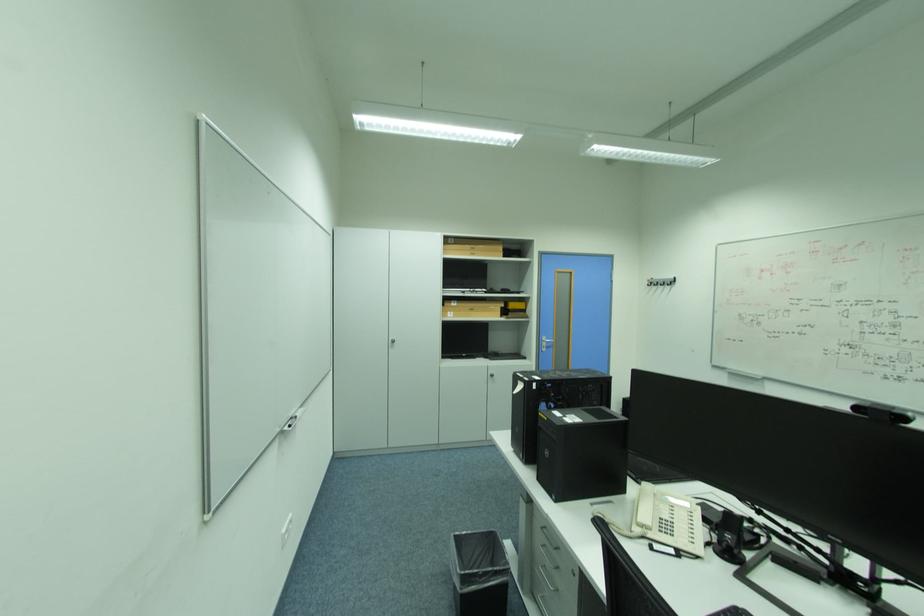
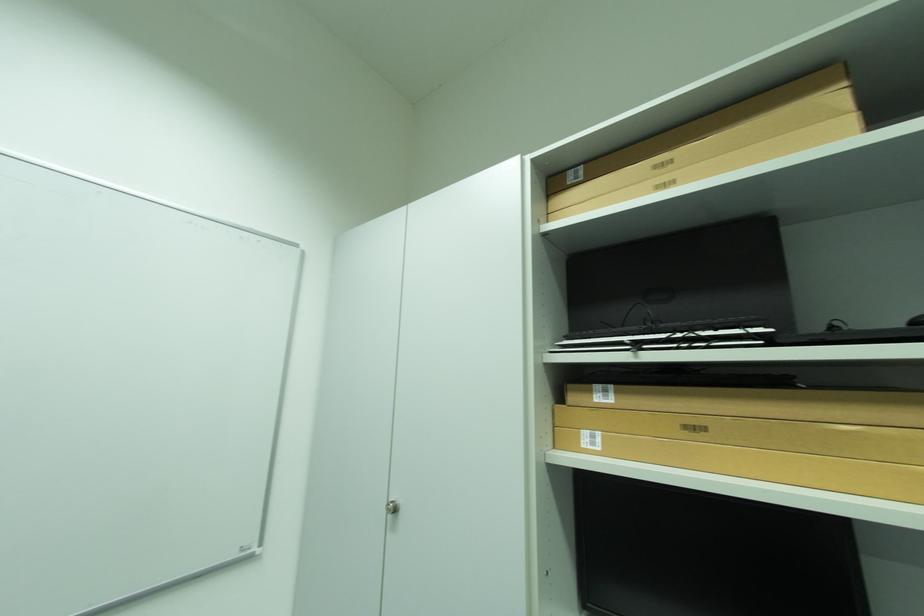
Find the pixel in the second image that matches point 463,302 in the first image.

(614, 392)